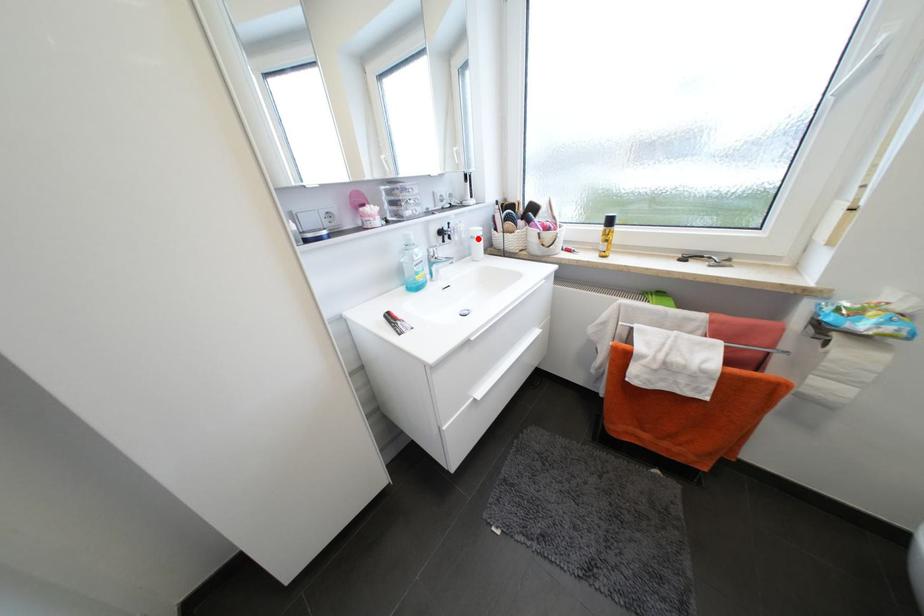
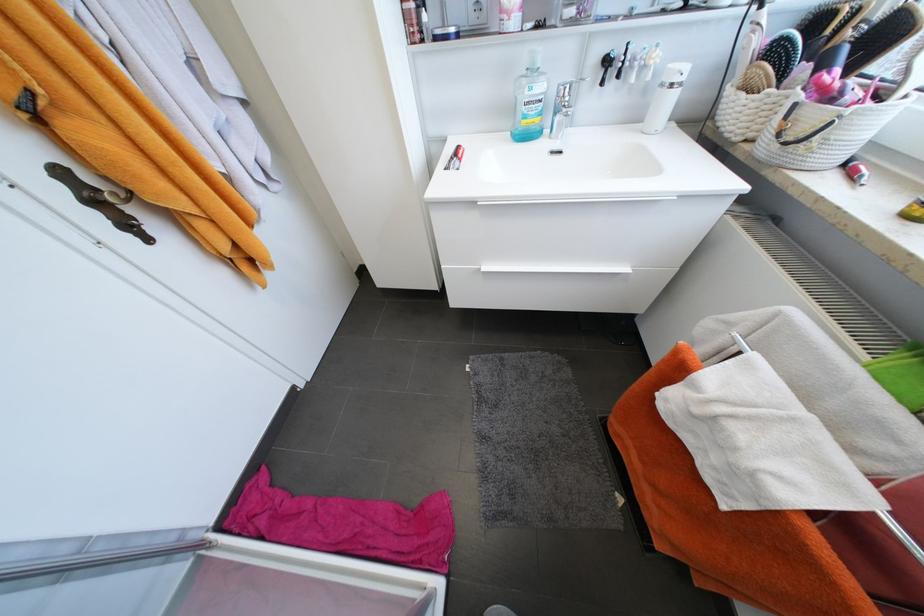
Question: I am providing you with two images of the same scene from different viewpoints. In image1, a red point is highlighted. Considering the same 3D point in image2, which of the following is correct?

Choices:
 (A) It is closer
 (B) It is farther

Answer: (B)